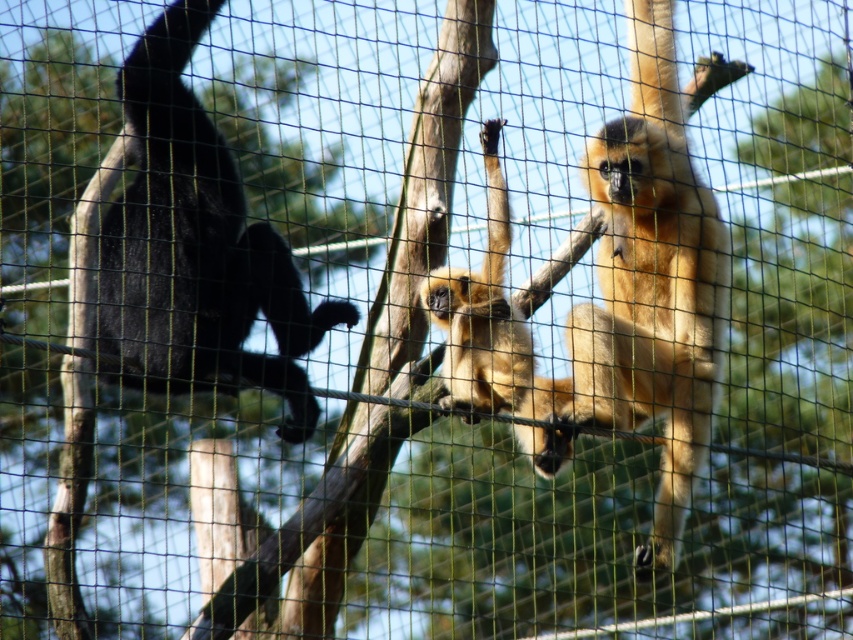
Question: Estimate the real-world distances between objects in this image. Which object is closer to the golden fur monkey at center?

Choices:
 (A) golden fur monkey at right
 (B) shiny black monkey at left

Answer: (A)

Question: Considering the real-world distances, which object is farthest from the golden fur monkey at right?

Choices:
 (A) golden fur monkey at center
 (B) shiny black monkey at left

Answer: (B)

Question: Can you confirm if shiny black monkey at left is positioned above golden fur monkey at center?

Choices:
 (A) no
 (B) yes

Answer: (B)

Question: Is shiny black monkey at left positioned in front of golden fur monkey at center?

Choices:
 (A) no
 (B) yes

Answer: (B)

Question: Can you confirm if golden fur monkey at right is positioned to the right of shiny black monkey at left?

Choices:
 (A) no
 (B) yes

Answer: (B)

Question: Which point appears closest to the camera in this image?

Choices:
 (A) (700, 451)
 (B) (521, 330)

Answer: (B)